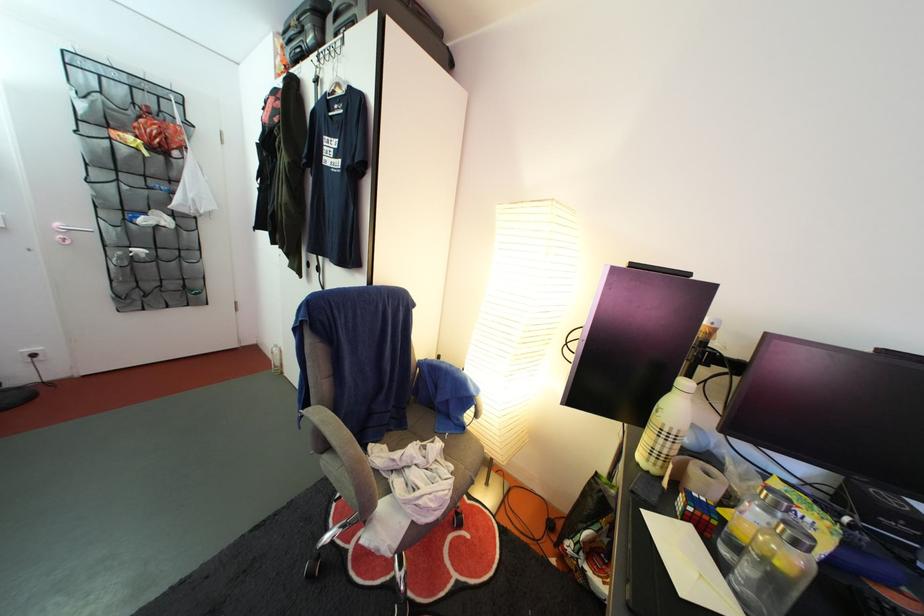
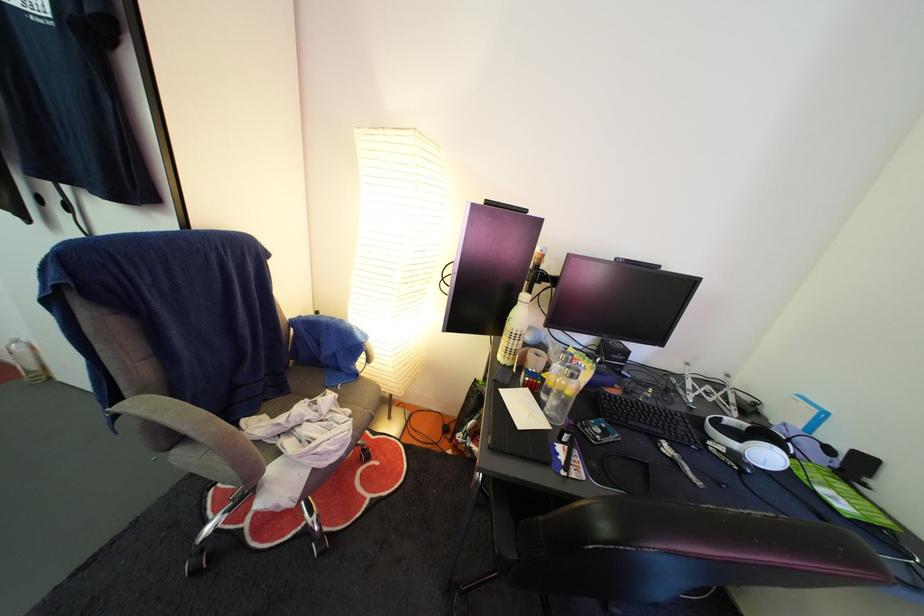
Where in the second image is the point corresponding to pixel 650 466 from the first image?

(509, 365)